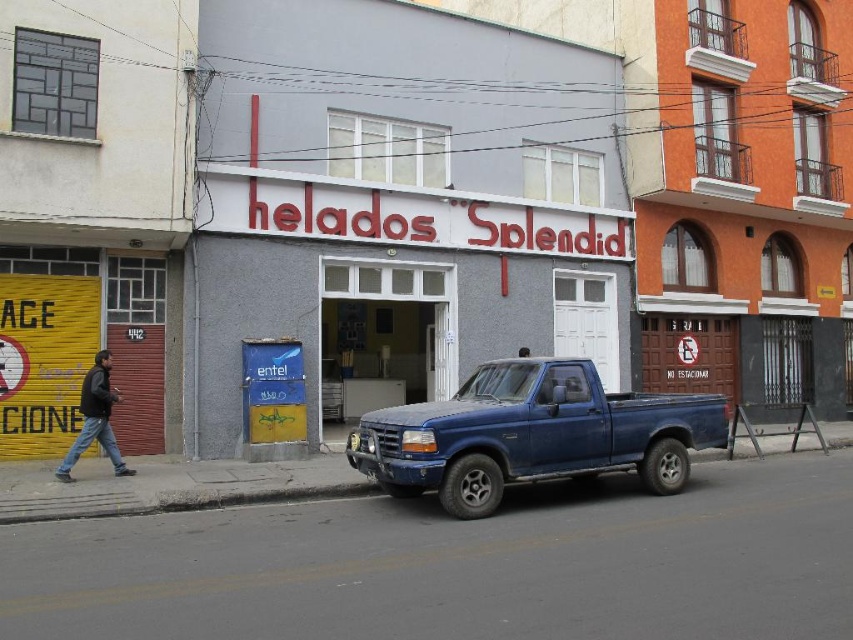
Consider the image. You are a delivery person who needs to park your 5.0 meter long truck. There is a matte blue truck at center and dark blue jeans at lower left in the scene. Can you fit your truck between them without overlapping?

The distance between the matte blue truck at center and dark blue jeans at lower left is 4.90 meters. Since your truck is 5.0 meters long, it would not fit between them as the space is slightly shorter than the truck.

What is located at the coordinates point [532,435]?

The matte blue truck at center is located at point [532,435].